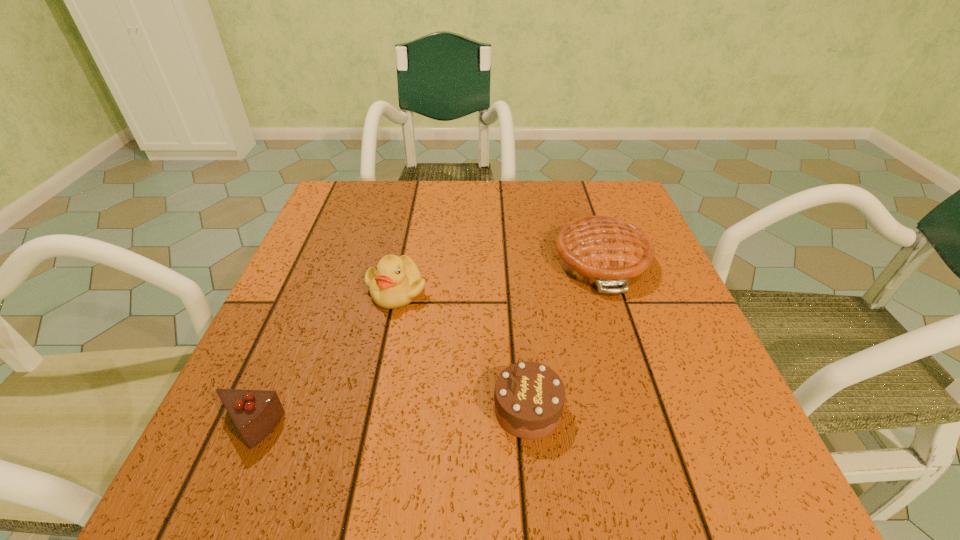
At what (x,y) coordinates should I click in order to perform the action: click on object at the far edge. Please return your answer as a coordinate pair (x, y). Looking at the image, I should click on (600, 251).

Where is `object present at the near edge`? Image resolution: width=960 pixels, height=540 pixels. object present at the near edge is located at coordinates (255, 413).

Find the location of a particular element. duckling that is at the left edge is located at coordinates (396, 282).

This screenshot has width=960, height=540. In order to click on chocolate cake located in the left edge section of the desktop in this screenshot , I will do pyautogui.click(x=255, y=413).

Locate an element on the screen. This screenshot has width=960, height=540. object at the right edge is located at coordinates (600, 251).

This screenshot has width=960, height=540. Find the location of `object at the near left corner`. object at the near left corner is located at coordinates (255, 413).

The width and height of the screenshot is (960, 540). I want to click on object that is at the far right corner, so click(600, 251).

In the image, there is a desktop. Where is `vacant space at the far edge`? vacant space at the far edge is located at coordinates (487, 225).

Where is `vacant space at the left edge of the desktop`? The image size is (960, 540). vacant space at the left edge of the desktop is located at coordinates (319, 269).

You are a GUI agent. You are given a task and a screenshot of the screen. Output one action in this format:
    pyautogui.click(x=<x>, y=<y>)
    Task: Click on the free spot at the right edge of the desktop
    The height and width of the screenshot is (540, 960).
    Given the screenshot: What is the action you would take?
    pyautogui.click(x=698, y=367)